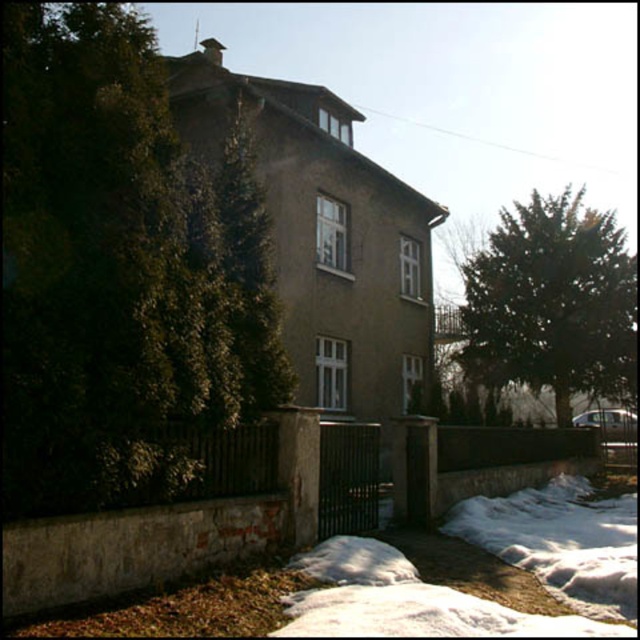
You are standing at the center of the image and want to walk towards the green leafy tree at left. Which direction should you face?

You should face the left direction to walk towards the green leafy tree at left since it is located at the left side of the image.

You are a delivery person arriving at the residential building. You see a green leafy tree at left and white fluffy snow at lower center. Which object takes up more horizontal space in the scene?

The white fluffy snow at lower center takes up more horizontal space than the green leafy tree at left because the green leafy tree at left has a lesser width compared to white fluffy snow at lower center.

You are standing in front of the residential building and want to walk towards the dark green textured tree at right. Which direction should you move relative to the white fluffy snow at lower center?

You should move away from the white fluffy snow at lower center towards the dark green textured tree at right since the snow is closer to you and the tree is further back.